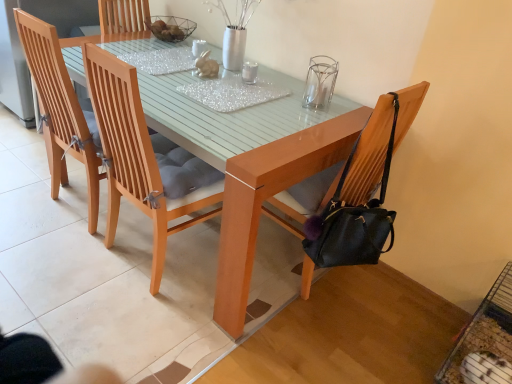
Where is `free space behind transparent glass candle holder at upper center`? The image size is (512, 384). free space behind transparent glass candle holder at upper center is located at coordinates (302, 88).